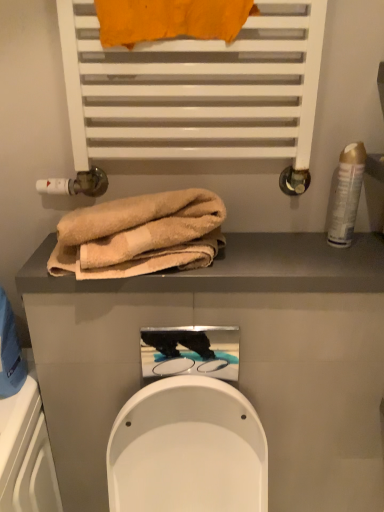
Image resolution: width=384 pixels, height=512 pixels. Describe the element at coordinates (140, 234) in the screenshot. I see `beige soft towel at center, the 2th towel when ordered from top to bottom` at that location.

This screenshot has height=512, width=384. I want to click on orange fabric towel at upper center, marked as the first towel in a top-to-bottom arrangement, so click(x=170, y=20).

What are the coordinates of `beige towel at upper center` in the screenshot? It's located at (241, 268).

In order to click on gold metallic can at right in this screenshot , I will do `click(347, 195)`.

Does beige towel at upper center lie behind beige soft towel at center, the 1th towel in the bottom-to-top sequence?

Yes, the depth of beige towel at upper center is greater than that of beige soft towel at center, the 1th towel in the bottom-to-top sequence.

From the image's perspective, which one is positioned higher, beige towel at upper center or beige soft towel at center, the 1th towel in the bottom-to-top sequence?

beige soft towel at center, the 1th towel in the bottom-to-top sequence.

Is beige towel at upper center at the left side of beige soft towel at center, the 2th towel when ordered from top to bottom?

In fact, beige towel at upper center is to the right of beige soft towel at center, the 2th towel when ordered from top to bottom.

From the picture: From a real-world perspective, is beige soft towel at center, the 2th towel when ordered from top to bottom, positioned over orange fabric towel at upper center, which is counted as the second towel, starting from the bottom, based on gravity?

No, from a real-world perspective, beige soft towel at center, the 2th towel when ordered from top to bottom, is not over orange fabric towel at upper center, which is counted as the second towel, starting from the bottom

Looking at this image, is beige soft towel at center, the 2th towel when ordered from top to bottom, positioned far away from orange fabric towel at upper center, marked as the first towel in a top-to-bottom arrangement?

Actually, beige soft towel at center, the 2th towel when ordered from top to bottom, and orange fabric towel at upper center, marked as the first towel in a top-to-bottom arrangement, are a little close together.

Would you say beige soft towel at center, the 2th towel when ordered from top to bottom, is inside or outside orange fabric towel at upper center, marked as the first towel in a top-to-bottom arrangement?

beige soft towel at center, the 2th towel when ordered from top to bottom, exists outside the volume of orange fabric towel at upper center, marked as the first towel in a top-to-bottom arrangement.

Based on the photo, between beige soft towel at center, the 2th towel when ordered from top to bottom, and orange fabric towel at upper center, which is counted as the second towel, starting from the bottom, which one has smaller width?

orange fabric towel at upper center, which is counted as the second towel, starting from the bottom, is thinner.

Between gold metallic can at right and white matte towel rack at upper center, which one is positioned behind?

gold metallic can at right.

The image size is (384, 512). I want to click on shelf that appears above the gold metallic can at right (from the image's perspective), so click(196, 90).

Would you say gold metallic can at right is outside white matte towel rack at upper center?

Indeed, gold metallic can at right is completely outside white matte towel rack at upper center.

From a real-world perspective, which object stands above the other?

In real-world perspective, white matte towel rack at upper center is above.

Is beige soft towel at center, the 1th towel in the bottom-to-top sequence, placed right next to gold metallic can at right?

beige soft towel at center, the 1th towel in the bottom-to-top sequence, and gold metallic can at right are not in contact.

From the image's perspective, which object appears higher, beige soft towel at center, the 1th towel in the bottom-to-top sequence, or gold metallic can at right?

From the image's view, gold metallic can at right is above.

Consider the image. Can you confirm if beige soft towel at center, the 1th towel in the bottom-to-top sequence, is shorter than gold metallic can at right?

Correct, beige soft towel at center, the 1th towel in the bottom-to-top sequence, is not as tall as gold metallic can at right.

Find the location of a particular element. This screenshot has width=384, height=512. toiletry lying behind the beige soft towel at center, the 2th towel when ordered from top to bottom is located at coordinates (347, 195).

Between white matte towel rack at upper center and gold metallic can at right, which one has less height?

Standing shorter between the two is gold metallic can at right.

From the image's perspective, which object appears higher, white matte towel rack at upper center or gold metallic can at right?

white matte towel rack at upper center.

Consider the image. Considering the relative positions of white matte towel rack at upper center and gold metallic can at right in the image provided, is white matte towel rack at upper center to the right of gold metallic can at right from the viewer's perspective?

No.

Do you think white matte towel rack at upper center is within orange fabric towel at upper center, which is counted as the second towel, starting from the bottom, or outside of it?

white matte towel rack at upper center cannot be found inside orange fabric towel at upper center, which is counted as the second towel, starting from the bottom.

Can you tell me how much white matte towel rack at upper center and orange fabric towel at upper center, which is counted as the second towel, starting from the bottom, differ in facing direction?

They differ by 0.00122 degrees in their facing directions.

Who is smaller, white matte towel rack at upper center or orange fabric towel at upper center, marked as the first towel in a top-to-bottom arrangement?

orange fabric towel at upper center, marked as the first towel in a top-to-bottom arrangement, is smaller.

From the image's perspective, relative to orange fabric towel at upper center, which is counted as the second towel, starting from the bottom, is white matte towel rack at upper center above or below?

white matte towel rack at upper center is below orange fabric towel at upper center, which is counted as the second towel, starting from the bottom.

Can you tell me how much white matte towel rack at upper center and beige soft towel at center, the 2th towel when ordered from top to bottom, differ in facing direction?

The facing directions of white matte towel rack at upper center and beige soft towel at center, the 2th towel when ordered from top to bottom, are 1.99e-05 degrees apart.

Who is bigger, white matte towel rack at upper center or beige soft towel at center, the 2th towel when ordered from top to bottom?

Bigger between the two is white matte towel rack at upper center.

Is white matte towel rack at upper center completely or partially outside of beige soft towel at center, the 2th towel when ordered from top to bottom?

Indeed, white matte towel rack at upper center is completely outside beige soft towel at center, the 2th towel when ordered from top to bottom.

From a real-world perspective, which is physically above, white matte towel rack at upper center or beige soft towel at center, the 2th towel when ordered from top to bottom?

In real-world perspective, white matte towel rack at upper center is above.

Which towel is the 2nd one when counting from the front of the beige towel at upper center? Please provide its 2D coordinates.

[(140, 234)]

You are a GUI agent. You are given a task and a screenshot of the screen. Output one action in this format:
    pyautogui.click(x=<x>, y=<y>)
    Task: Click on the towel on the left of the orange fabric towel at upper center, marked as the first towel in a top-to-bottom arrangement
    
    Given the screenshot: What is the action you would take?
    pyautogui.click(x=140, y=234)

Estimate the real-world distances between objects in this image. Which object is closer to beige towel at upper center, beige soft towel at center, the 1th towel in the bottom-to-top sequence, or white matte towel rack at upper center?

Based on the image, beige soft towel at center, the 1th towel in the bottom-to-top sequence, appears to be nearer to beige towel at upper center.

Based on their spatial positions, is beige soft towel at center, the 1th towel in the bottom-to-top sequence, or beige towel at upper center closer to orange fabric towel at upper center, which is counted as the second towel, starting from the bottom?

beige soft towel at center, the 1th towel in the bottom-to-top sequence.

When comparing their distances from beige soft towel at center, the 2th towel when ordered from top to bottom, does beige towel at upper center or orange fabric towel at upper center, marked as the first towel in a top-to-bottom arrangement, seem further?

orange fabric towel at upper center, marked as the first towel in a top-to-bottom arrangement.

Consider the image. From the image, which object appears to be farther from white matte towel rack at upper center, beige soft towel at center, the 2th towel when ordered from top to bottom, or orange fabric towel at upper center, which is counted as the second towel, starting from the bottom?

beige soft towel at center, the 2th towel when ordered from top to bottom, lies further to white matte towel rack at upper center than the other object.

Estimate the real-world distances between objects in this image. Which object is closer to beige towel at upper center, beige soft towel at center, the 2th towel when ordered from top to bottom, or gold metallic can at right?

beige soft towel at center, the 2th towel when ordered from top to bottom, lies closer to beige towel at upper center than the other object.

Looking at the image, which one is located closer to gold metallic can at right, beige towel at upper center or orange fabric towel at upper center, which is counted as the second towel, starting from the bottom?

The object closer to gold metallic can at right is beige towel at upper center.

Estimate the real-world distances between objects in this image. Which object is closer to orange fabric towel at upper center, marked as the first towel in a top-to-bottom arrangement, beige towel at upper center or gold metallic can at right?

Among the two, gold metallic can at right is located nearer to orange fabric towel at upper center, marked as the first towel in a top-to-bottom arrangement.

Estimate the real-world distances between objects in this image. Which object is closer to beige soft towel at center, the 1th towel in the bottom-to-top sequence, orange fabric towel at upper center, which is counted as the second towel, starting from the bottom, or gold metallic can at right?

Among the two, orange fabric towel at upper center, which is counted as the second towel, starting from the bottom, is located nearer to beige soft towel at center, the 1th towel in the bottom-to-top sequence.

This screenshot has width=384, height=512. Identify the location of shelf between orange fabric towel at upper center, marked as the first towel in a top-to-bottom arrangement, and beige soft towel at center, the 2th towel when ordered from top to bottom, in the up-down direction. (196, 90).

In order to click on shelf located between beige soft towel at center, the 2th towel when ordered from top to bottom, and gold metallic can at right in the left-right direction in this screenshot , I will do `click(196, 90)`.

You are a GUI agent. You are given a task and a screenshot of the screen. Output one action in this format:
    pyautogui.click(x=<x>, y=<y>)
    Task: Click on the toiletry between orange fabric towel at upper center, marked as the first towel in a top-to-bottom arrangement, and beige towel at upper center from top to bottom
    
    Given the screenshot: What is the action you would take?
    pyautogui.click(x=347, y=195)

This screenshot has height=512, width=384. Identify the location of towel between orange fabric towel at upper center, marked as the first towel in a top-to-bottom arrangement, and beige towel at upper center, in the vertical direction. (140, 234).